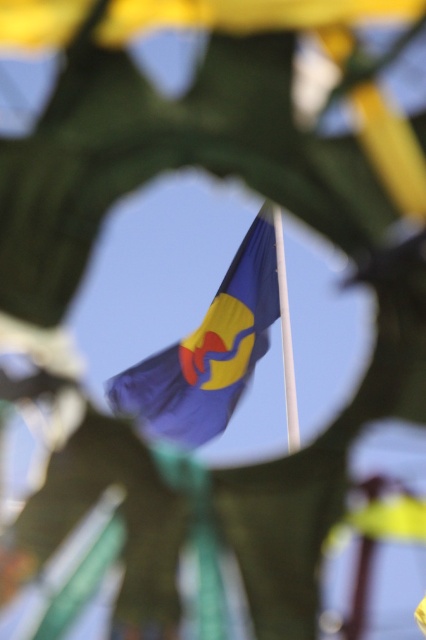
Question: Which point is closer to the camera?

Choices:
 (A) (275, 209)
 (B) (134, 412)

Answer: (A)

Question: Does blue fabric flag at center appear under white smooth pole at center?

Choices:
 (A) no
 (B) yes

Answer: (A)

Question: Is blue fabric flag at center to the right of white smooth pole at center from the viewer's perspective?

Choices:
 (A) yes
 (B) no

Answer: (B)

Question: Among these objects, which one is nearest to the camera?

Choices:
 (A) white smooth pole at center
 (B) blue fabric flag at center

Answer: (A)

Question: Can you confirm if blue fabric flag at center is bigger than white smooth pole at center?

Choices:
 (A) no
 (B) yes

Answer: (B)